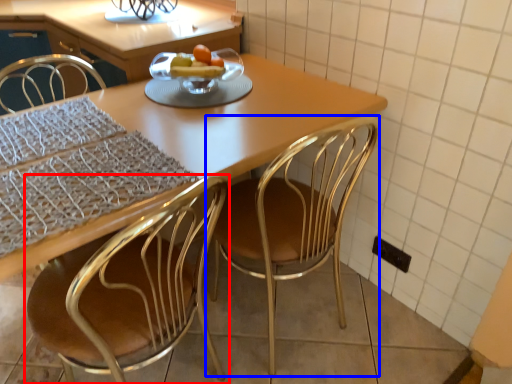
Question: Which object appears farthest to the camera in this image, chair (highlighted by a red box) or chair (highlighted by a blue box)?

Choices:
 (A) chair
 (B) chair

Answer: (B)